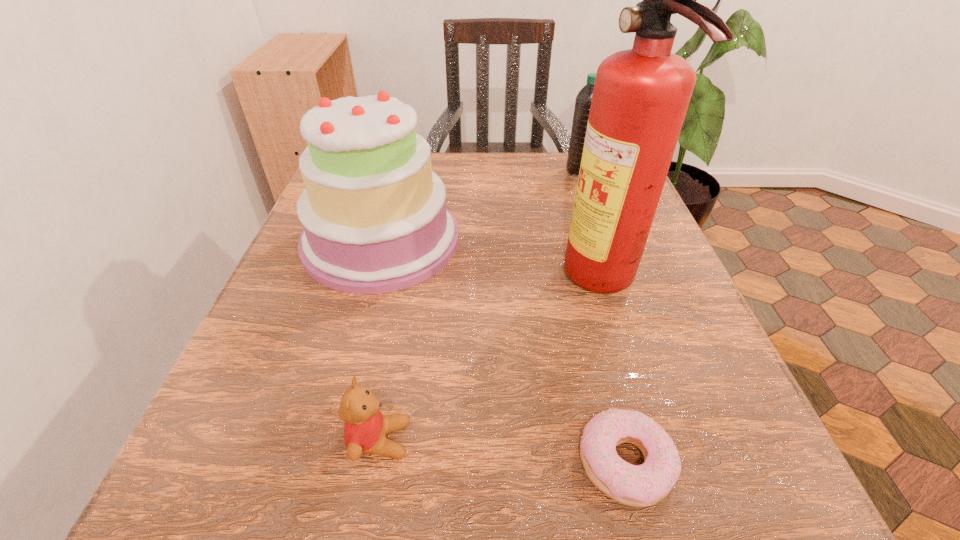
At what (x,y) coordinates should I click in order to perform the action: click on the tallest object. Please return your answer as a coordinate pair (x, y). This screenshot has height=540, width=960. Looking at the image, I should click on (641, 95).

At what (x,y) coordinates should I click in order to perform the action: click on cake. Please return your answer as a coordinate pair (x, y). The height and width of the screenshot is (540, 960). Looking at the image, I should click on (374, 214).

Find the location of a particular element. This screenshot has width=960, height=540. water bottle is located at coordinates (583, 99).

You are a GUI agent. You are given a task and a screenshot of the screen. Output one action in this format:
    pyautogui.click(x=<x>, y=<y>)
    Task: Click on the farthest object
    
    Given the screenshot: What is the action you would take?
    click(583, 99)

Locate an element on the screen. This screenshot has width=960, height=540. teddy bear is located at coordinates (365, 429).

Find the location of `doughnut`. doughnut is located at coordinates (643, 485).

This screenshot has height=540, width=960. Find the location of `free region located 0.250m on the front-facing side of the fire extinguisher`. free region located 0.250m on the front-facing side of the fire extinguisher is located at coordinates (423, 282).

The width and height of the screenshot is (960, 540). I want to click on vacant space located 0.380m on the front-facing side of the fire extinguisher, so click(350, 282).

The image size is (960, 540). I want to click on vacant space located on the front-facing side of the fire extinguisher, so click(x=435, y=282).

Where is `free space located on the right of the second tallest object`? The height and width of the screenshot is (540, 960). free space located on the right of the second tallest object is located at coordinates (636, 240).